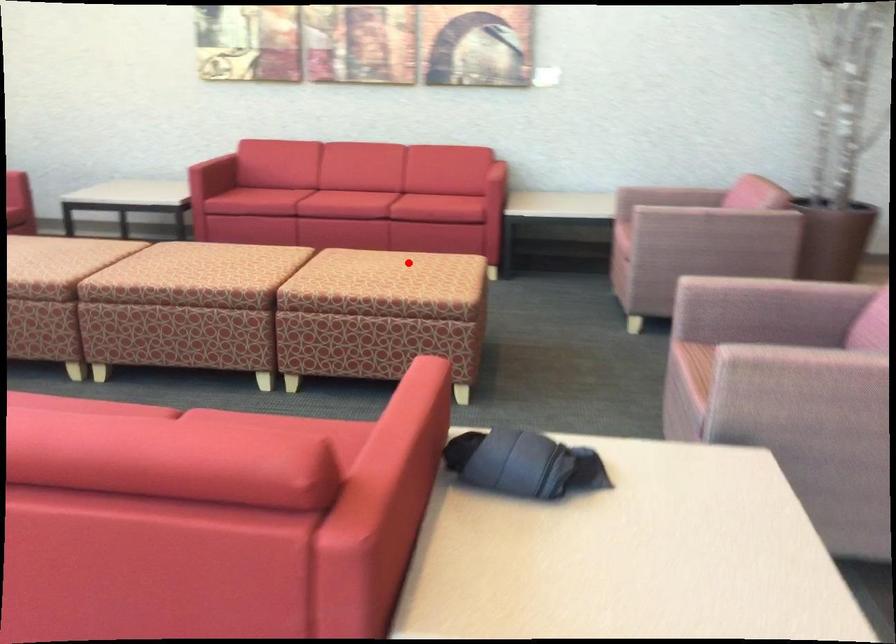
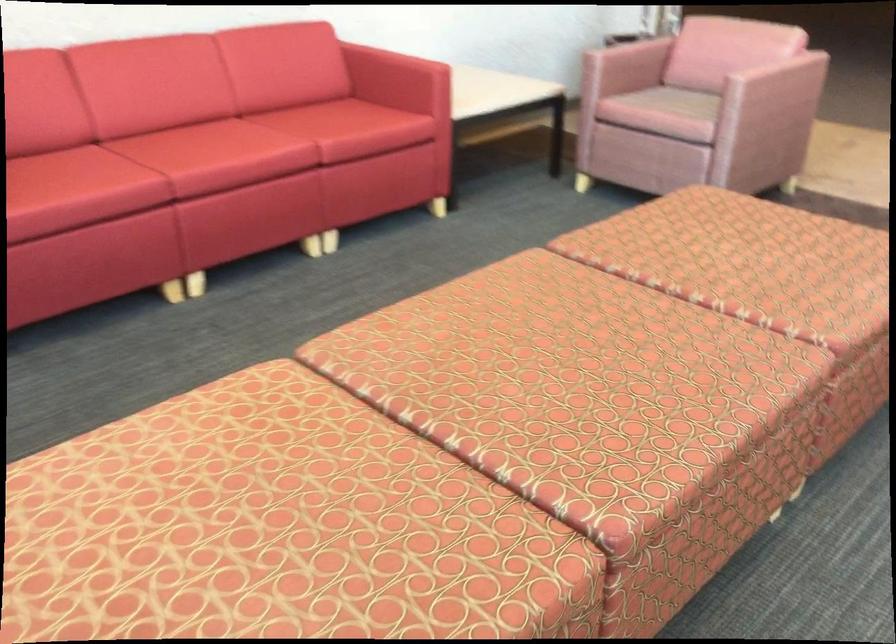
Find the pixel in the second image that matches the highlighted location in the first image.

(762, 245)